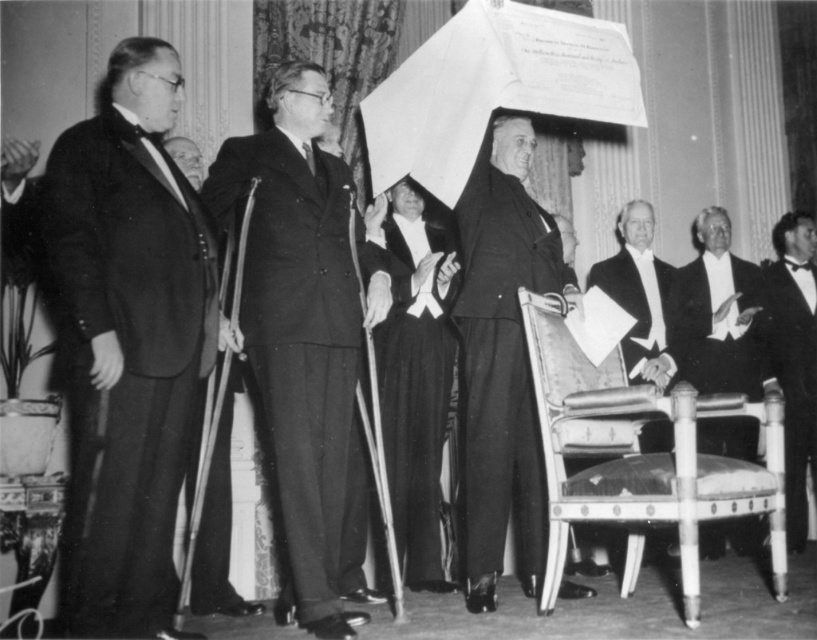
Can you confirm if smooth black suit at left is wider than white satin suit at right?

Correct, the width of smooth black suit at left exceeds that of white satin suit at right.

Between point (199, 269) and point (653, 305), which one is positioned in front?

Positioned in front is point (199, 269).

Where is `smooth black suit at left`? The height and width of the screenshot is (640, 817). smooth black suit at left is located at coordinates (124, 358).

Measure the distance between white tuxedo at right and white satin suit at right.

white tuxedo at right and white satin suit at right are 11.67 inches apart.

Is white tuxedo at right positioned in front of white satin suit at right?

No, it is behind white satin suit at right.

Locate an element on the screen. The image size is (817, 640). white tuxedo at right is located at coordinates (720, 314).

Measure the distance between point (422, 234) and camera.

The distance of point (422, 234) from camera is 4.80 meters.

Is point (404, 312) positioned in front of point (791, 506)?

Yes, it is.

Which is behind, point (423, 577) or point (771, 292)?

Positioned behind is point (771, 292).

Identify the location of silky black robe at center. (414, 394).